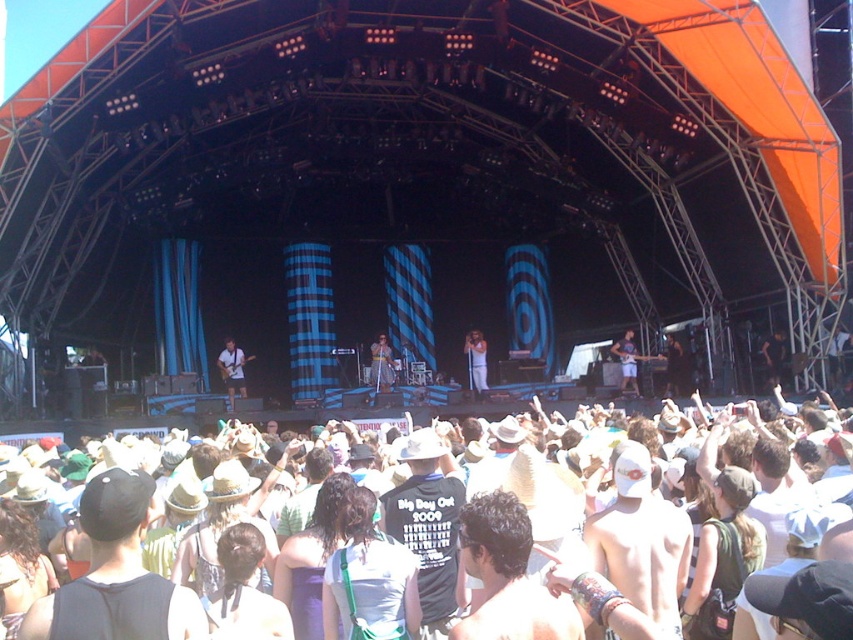
Question: Is white cotton crowd at center above dark brown leather jacket at center?

Choices:
 (A) yes
 (B) no

Answer: (B)

Question: Which point is farther to the camera?

Choices:
 (A) (474, 356)
 (B) (630, 358)
 (C) (383, 339)

Answer: (C)

Question: Among these points, which one is farthest from the camera?

Choices:
 (A) (624, 353)
 (B) (236, 356)
 (C) (483, 348)

Answer: (C)

Question: Among these objects, which one is farthest from the camera?

Choices:
 (A) white fabric shirt at center
 (B) white cotton crowd at center
 (C) shiny silver microphone at center

Answer: (A)

Question: Is white fabric shirt at center positioned in front of shiny silver guitar at center?

Choices:
 (A) no
 (B) yes

Answer: (A)

Question: In this image, where is white fabric shirt at center located relative to dark brown leather jacket at center?

Choices:
 (A) left
 (B) right

Answer: (A)